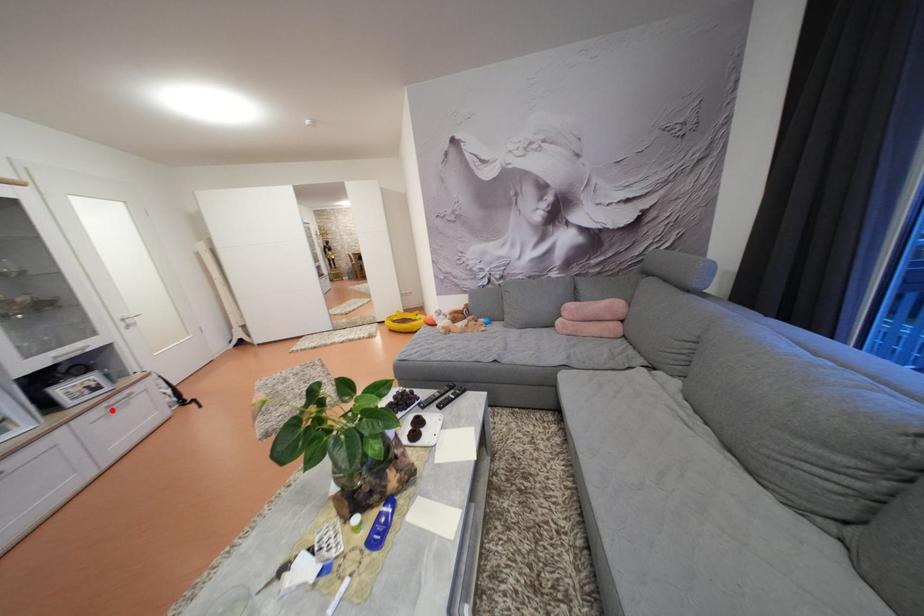
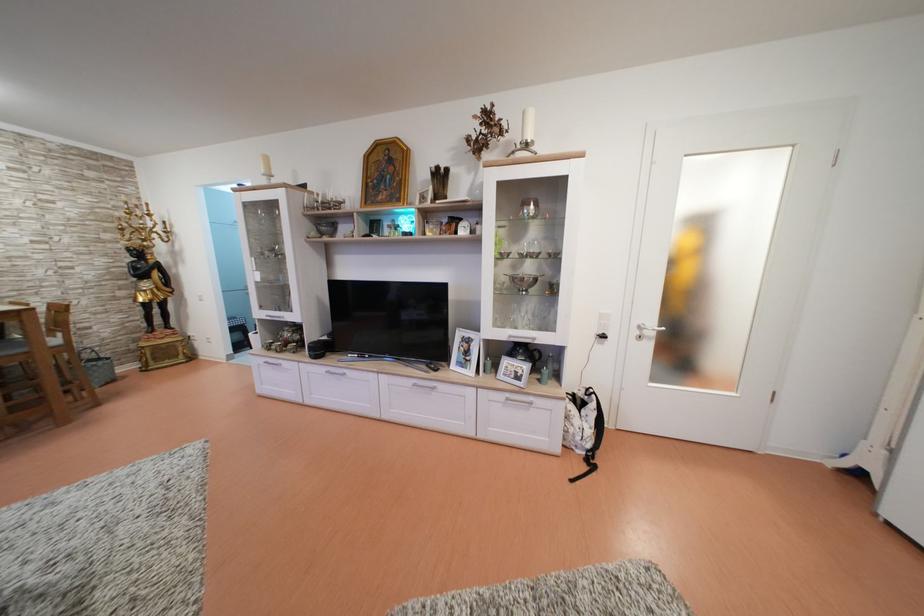
Question: I am providing you with two images of the same scene from different viewpoints. A red point is marked on the first image. Can you still see the location of the red point in image 2?

Choices:
 (A) Yes
 (B) No

Answer: (A)